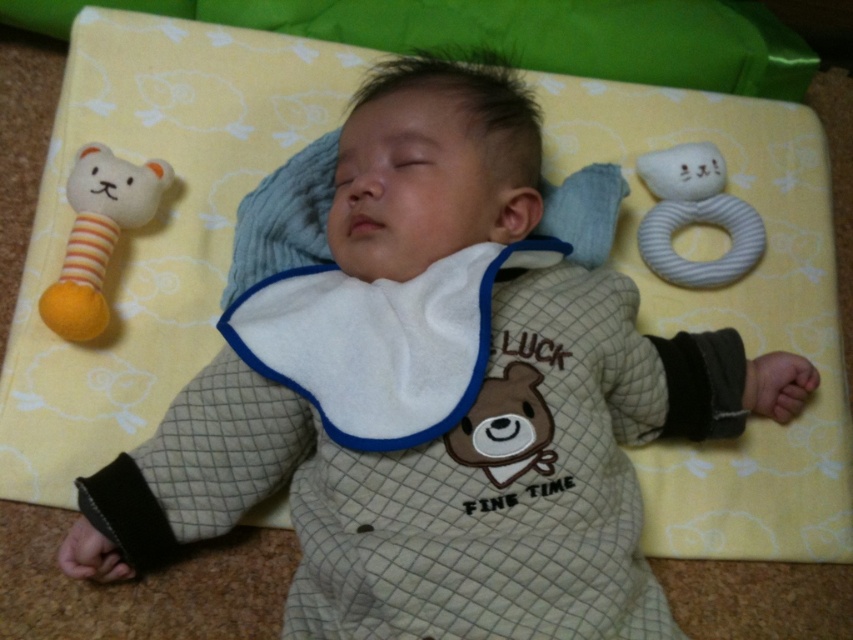
You are a parent who wants to pick up the yellow striped plush toy at left without waking the baby. Since the baby is sleeping on a yellow mat, can you reach the toy from your current position 4 feet away from the camera?

The yellow striped plush toy at left is 3.53 feet away from the camera. Since you are 4 feet away from the camera, you can reach it without moving closer.

You are a parent checking on your baby. You notice the white fabric ring at upper right and the brown plush bear at center. Which toy is taller?

The white fabric ring at upper right is taller than the brown plush bear at center.

You are a parent holding a baby toy that is 1 meter long. You want to place it on the floor near the white fabric ring at upper right without moving the ring. Is there enough space between you and the ring to do this?

The distance between you and the white fabric ring at upper right is 1.22 meters, which is greater than the 1 meter length of the toy. Therefore, there is enough space to place the toy near the ring without moving it.